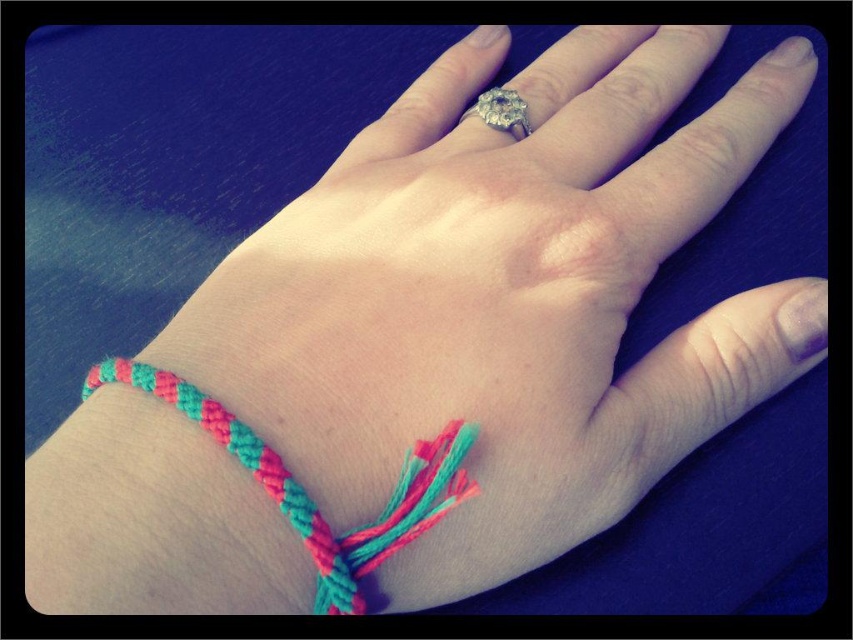
Question: Which of the following is the farthest from the observer?

Choices:
 (A) braided fabric bracelet at lower left
 (B) diamond ring at center

Answer: (B)

Question: Can you confirm if braided fabric bracelet at lower left is wider than diamond ring at center?

Choices:
 (A) no
 (B) yes

Answer: (B)

Question: Observing the image, what is the correct spatial positioning of braided fabric bracelet at lower left in reference to diamond ring at center?

Choices:
 (A) above
 (B) below

Answer: (B)

Question: Can you confirm if braided fabric bracelet at lower left is wider than diamond ring at center?

Choices:
 (A) yes
 (B) no

Answer: (A)